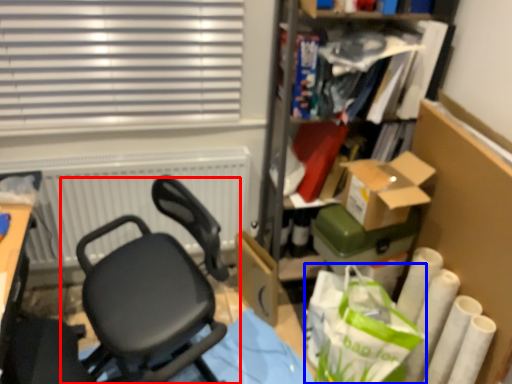
Question: Which of the following is the farthest to the observer, chair (highlighted by a red box) or shopping bag (highlighted by a blue box)?

Choices:
 (A) chair
 (B) shopping bag

Answer: (B)